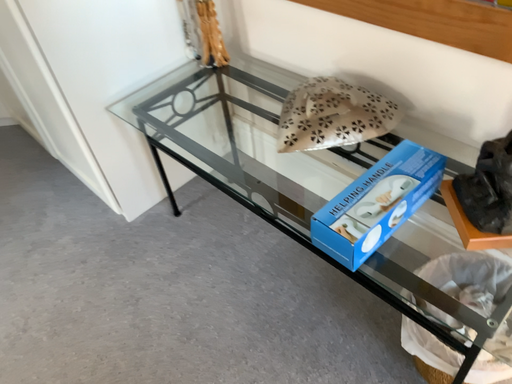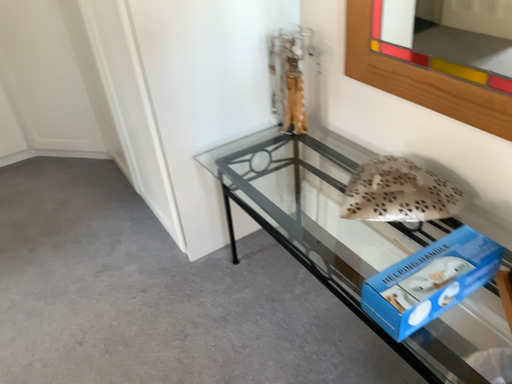
Question: Which way did the camera rotate in the video?

Choices:
 (A) rotated upward
 (B) rotated downward

Answer: (A)